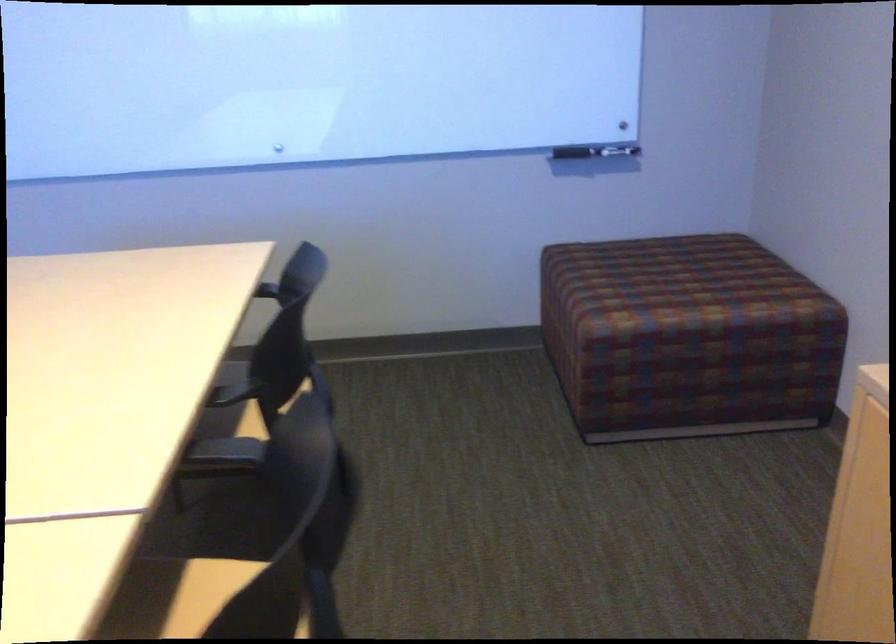
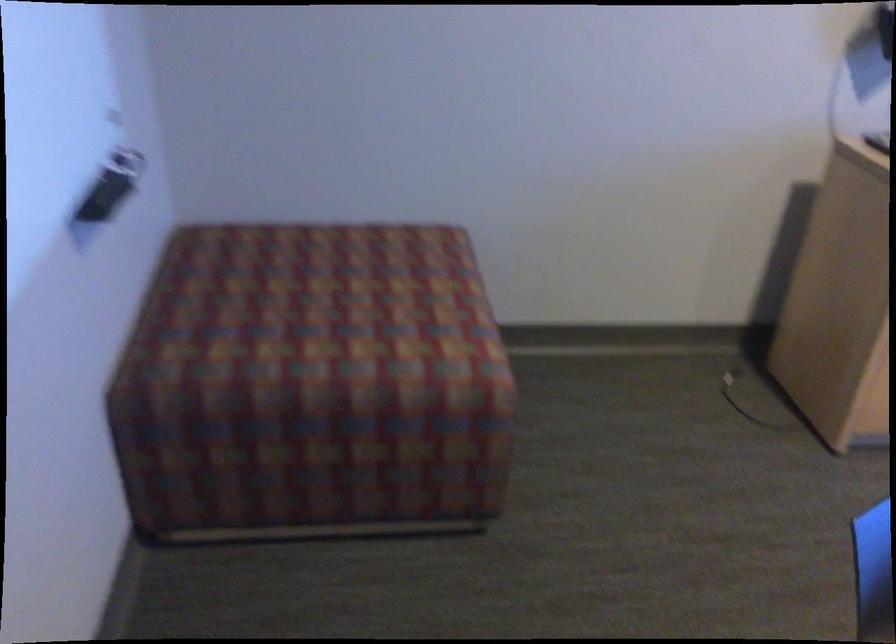
Locate, in the second image, the point that corresponds to point 652,269 in the first image.

(332, 301)